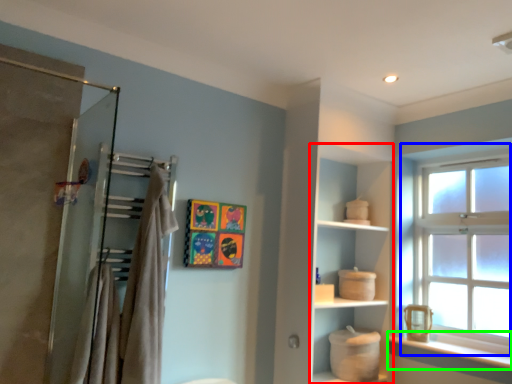
Question: Which object is positioned closest to cabinet (highlighted by a red box)? Select from window (highlighted by a blue box) and window sill (highlighted by a green box).

Choices:
 (A) window
 (B) window sill

Answer: (A)